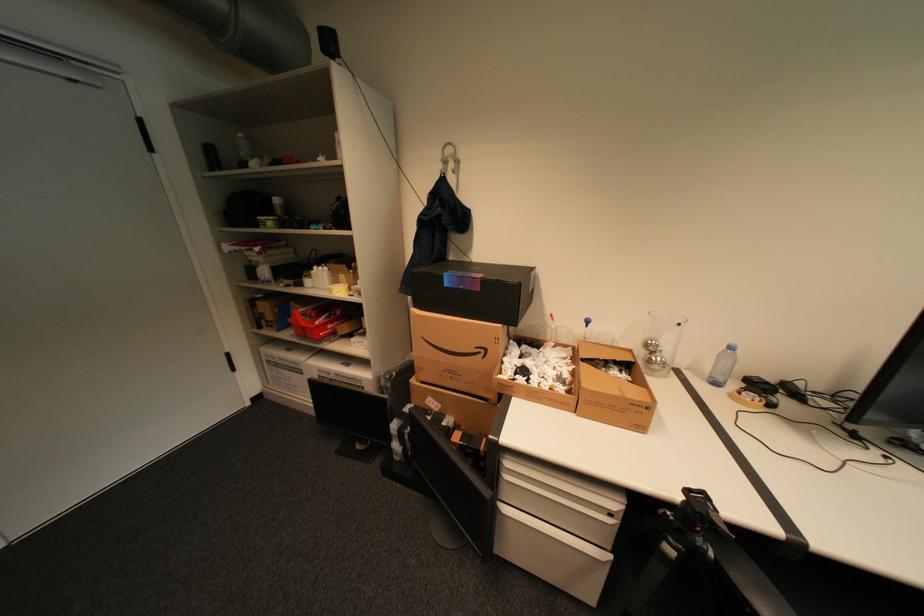
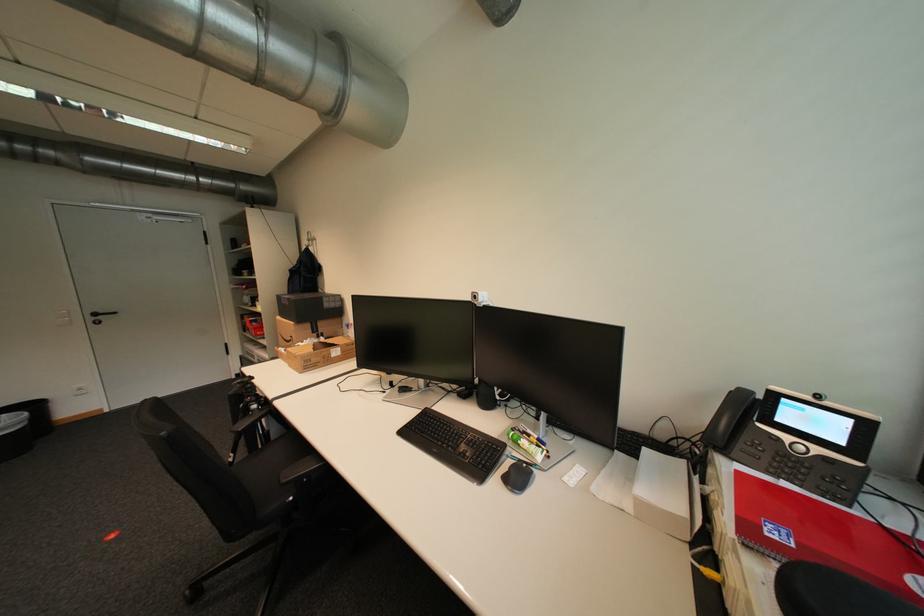
The point at (487,291) is marked in the first image. Where is the corresponding point in the second image?

(296, 305)